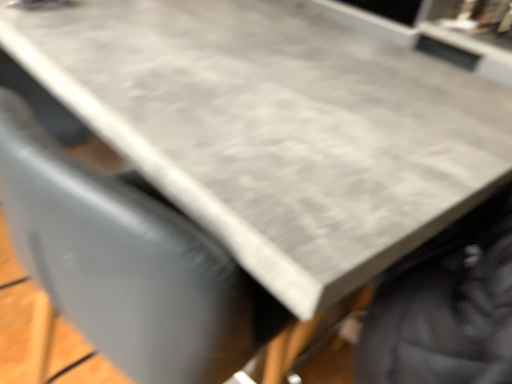
Locate an element on the screen. The width and height of the screenshot is (512, 384). matte gray swivel chair at center is located at coordinates (126, 264).

What is the approximate height of matte gray swivel chair at center?

94.50 centimeters.

The image size is (512, 384). What do you see at coordinates (126, 264) in the screenshot? I see `matte gray swivel chair at center` at bounding box center [126, 264].

In order to click on matte gray swivel chair at center in this screenshot , I will do `click(126, 264)`.